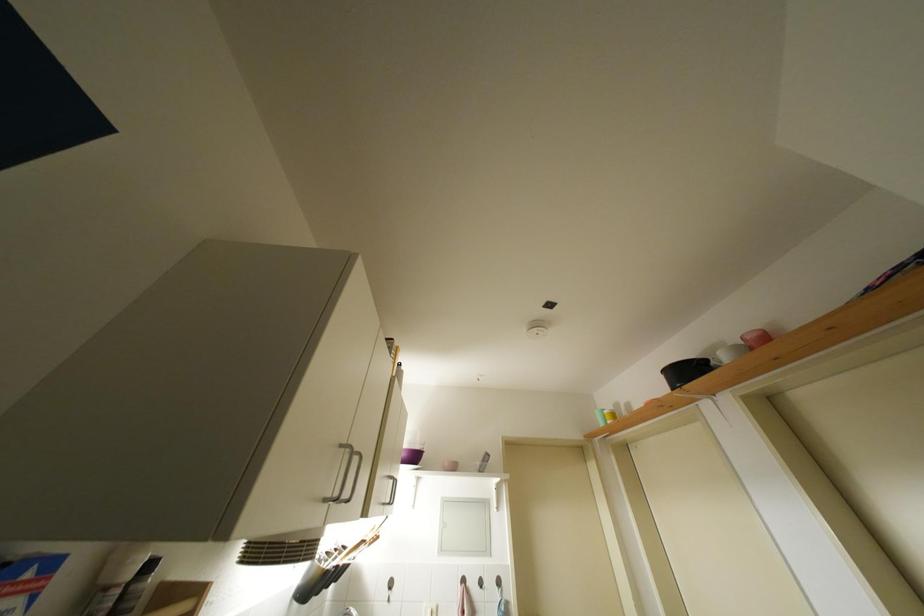
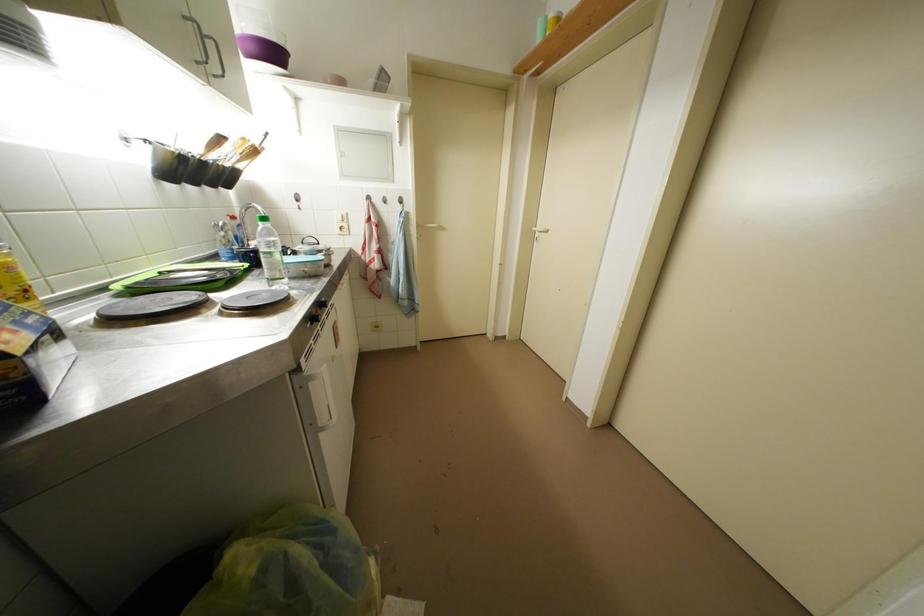
Based on the continuous images, in which direction is the camera rotating?

The camera's rotation is toward right-down.